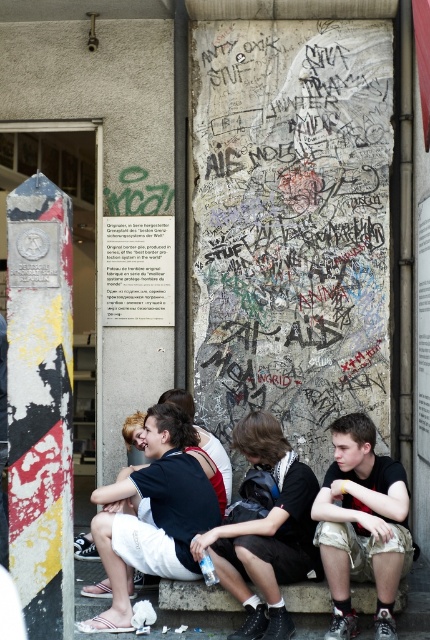
Looking at this image, measure the distance between grungy concrete wall at center and dark brown leather jacket at center.

5.51 feet

Does grungy concrete wall at center have a lesser width compared to dark brown leather jacket at center?

In fact, grungy concrete wall at center might be wider than dark brown leather jacket at center.

This screenshot has height=640, width=430. Describe the element at coordinates (291, 225) in the screenshot. I see `grungy concrete wall at center` at that location.

Locate an element on the screen. This screenshot has width=430, height=640. grungy concrete wall at center is located at coordinates (291, 225).

Does painted concrete post at left appear on the left side of dark brown leather jacket at center?

Yes, painted concrete post at left is to the left of dark brown leather jacket at center.

Does painted concrete post at left have a smaller size compared to dark brown leather jacket at center?

Yes, painted concrete post at left is smaller than dark brown leather jacket at center.

The image size is (430, 640). Identify the location of painted concrete post at left. (40, 404).

Between dark gray fabric shorts at lower right and dark brown leather jacket at center, which one appears on the left side from the viewer's perspective?

From the viewer's perspective, dark brown leather jacket at center appears more on the left side.

Between dark gray fabric shorts at lower right and dark brown leather jacket at center, which one is positioned higher?

dark gray fabric shorts at lower right is above.

Where is `dark gray fabric shorts at lower right`? This screenshot has width=430, height=640. dark gray fabric shorts at lower right is located at coordinates (362, 524).

Locate an element on the screen. This screenshot has height=640, width=430. dark gray fabric shorts at lower right is located at coordinates (362, 524).